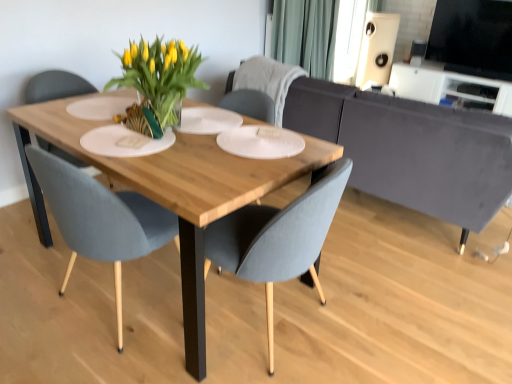
Question: Is white matte window screen at upper center, acting as the 1th window screen starting from the left, thinner than black glossy tv at upper right, the 2th window screen viewed from the left?

Choices:
 (A) yes
 (B) no

Answer: (B)

Question: From a real-world perspective, does white matte window screen at upper center, which is counted as the second window screen, starting from the right, stand above black glossy tv at upper right, acting as the second window screen starting from the back?

Choices:
 (A) yes
 (B) no

Answer: (B)

Question: Is black glossy tv at upper right, which is counted as the first window screen, starting from the right, at the back of white matte window screen at upper center, the second window screen viewed from the front?

Choices:
 (A) yes
 (B) no

Answer: (B)

Question: Does white matte window screen at upper center, acting as the 1th window screen starting from the back, have a smaller size compared to black glossy tv at upper right, which is counted as the first window screen, starting from the right?

Choices:
 (A) no
 (B) yes

Answer: (A)

Question: Considering the relative sizes of white matte window screen at upper center, acting as the 1th window screen starting from the back, and black glossy tv at upper right, acting as the second window screen starting from the back, in the image provided, is white matte window screen at upper center, acting as the 1th window screen starting from the back, bigger than black glossy tv at upper right, acting as the second window screen starting from the back,?

Choices:
 (A) no
 (B) yes

Answer: (B)

Question: Considering the relative sizes of white matte window screen at upper center, which is counted as the second window screen, starting from the right, and black glossy tv at upper right, the 2th window screen viewed from the left, in the image provided, is white matte window screen at upper center, which is counted as the second window screen, starting from the right, taller than black glossy tv at upper right, the 2th window screen viewed from the left,?

Choices:
 (A) no
 (B) yes

Answer: (B)

Question: Does matte gray chair at center, which is the 2th chair from front to back, have a larger size compared to white matte speaker at upper right?

Choices:
 (A) no
 (B) yes

Answer: (B)

Question: Considering the relative sizes of matte gray chair at center, marked as the 2th chair in a back-to-front arrangement, and white matte speaker at upper right in the image provided, is matte gray chair at center, marked as the 2th chair in a back-to-front arrangement, wider than white matte speaker at upper right?

Choices:
 (A) no
 (B) yes

Answer: (B)

Question: From a real-world perspective, is matte gray chair at center, which is the 2th chair from front to back, below white matte speaker at upper right?

Choices:
 (A) no
 (B) yes

Answer: (B)

Question: From a real-world perspective, does matte gray chair at center, marked as the 2th chair in a back-to-front arrangement, stand above white matte speaker at upper right?

Choices:
 (A) no
 (B) yes

Answer: (A)

Question: Is the depth of matte gray chair at center, marked as the 2th chair in a back-to-front arrangement, greater than that of white matte speaker at upper right?

Choices:
 (A) yes
 (B) no

Answer: (B)

Question: Does gray fabric chair at center, the 3th chair in the front-to-back sequence, contain white matte window screen at upper center, acting as the 1th window screen starting from the back?

Choices:
 (A) no
 (B) yes

Answer: (A)